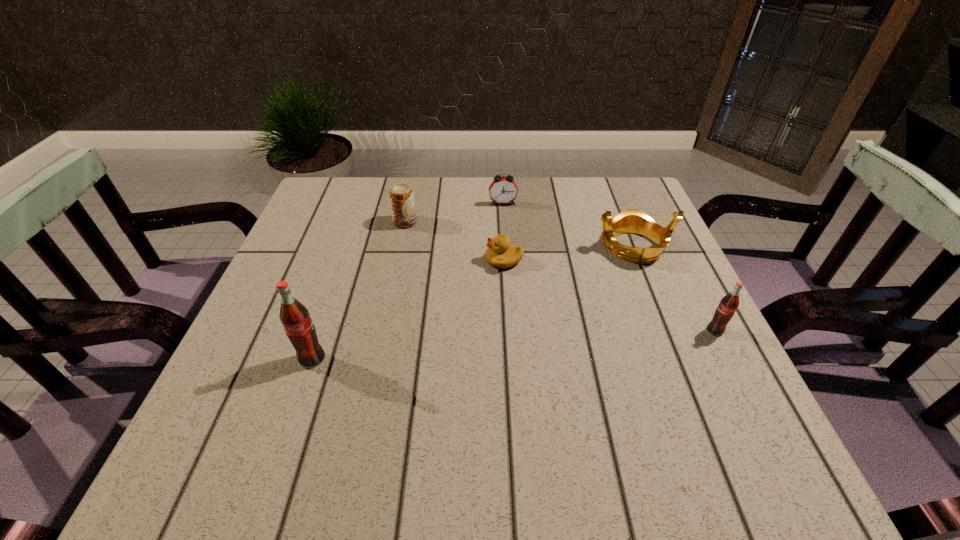
Point out which object is positioned as the fifth nearest to the alarm clock. Please provide its 2D coordinates. Your answer should be formatted as a tuple, i.e. [(x, y)], where the tuple contains the x and y coordinates of a point satisfying the conditions above.

[(295, 318)]

This screenshot has height=540, width=960. Find the location of `free space that satisfies the following two spatial constraints: 1. on the front-facing side of the duckling; 2. on the label of the tallest object`. free space that satisfies the following two spatial constraints: 1. on the front-facing side of the duckling; 2. on the label of the tallest object is located at coordinates (510, 359).

Image resolution: width=960 pixels, height=540 pixels. I want to click on vacant space that satisfies the following two spatial constraints: 1. on the clock face of the alarm clock; 2. on the front-facing side of the duckling, so click(x=507, y=260).

I want to click on blank space that satisfies the following two spatial constraints: 1. at the front emblem of the tiara; 2. on the label of the leftmost object, so click(678, 359).

The width and height of the screenshot is (960, 540). Find the location of `free space that satisfies the following two spatial constraints: 1. on the clock face of the alarm clock; 2. on the front-facing side of the shortest object`. free space that satisfies the following two spatial constraints: 1. on the clock face of the alarm clock; 2. on the front-facing side of the shortest object is located at coordinates (507, 260).

Identify the location of vacant space that satisfies the following two spatial constraints: 1. on the clock face of the alarm clock; 2. on the front-facing side of the duckling. (507, 260).